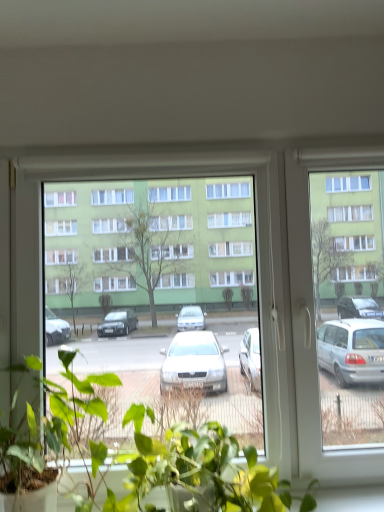
Question: Is green matte plant at center, acting as the second houseplant starting from the right, next to green leafy plant at lower center, which is the first houseplant in right-to-left order?

Choices:
 (A) yes
 (B) no

Answer: (A)

Question: From the image's perspective, does green matte plant at center, acting as the second houseplant starting from the right, appear higher than green leafy plant at lower center, the second houseplant viewed from the left?

Choices:
 (A) no
 (B) yes

Answer: (B)

Question: Is green matte plant at center, acting as the second houseplant starting from the right, wider than green leafy plant at lower center, the second houseplant viewed from the left?

Choices:
 (A) no
 (B) yes

Answer: (B)

Question: Is green matte plant at center, acting as the second houseplant starting from the right, positioned with its back to green leafy plant at lower center, which is the first houseplant in right-to-left order?

Choices:
 (A) yes
 (B) no

Answer: (B)

Question: Is green leafy plant at lower center, which is the first houseplant in right-to-left order, completely or partially inside green matte plant at center, acting as the second houseplant starting from the right?

Choices:
 (A) yes
 (B) no

Answer: (B)

Question: Is green matte plant at center, which appears as the first houseplant when viewed from the left, positioned in front of green leafy plant at lower center, which is the first houseplant in right-to-left order?

Choices:
 (A) no
 (B) yes

Answer: (B)

Question: Is transparent glass window at center not near green matte plant at center, acting as the second houseplant starting from the right?

Choices:
 (A) yes
 (B) no

Answer: (B)

Question: Is transparent glass window at center closer to camera compared to green matte plant at center, acting as the second houseplant starting from the right?

Choices:
 (A) no
 (B) yes

Answer: (A)

Question: Is transparent glass window at center positioned with its back to green matte plant at center, acting as the second houseplant starting from the right?

Choices:
 (A) no
 (B) yes

Answer: (B)

Question: Considering the relative sizes of transparent glass window at center and green matte plant at center, acting as the second houseplant starting from the right, in the image provided, is transparent glass window at center bigger than green matte plant at center, acting as the second houseplant starting from the right,?

Choices:
 (A) no
 (B) yes

Answer: (B)

Question: From a real-world perspective, is transparent glass window at center physically below green matte plant at center, which appears as the first houseplant when viewed from the left?

Choices:
 (A) yes
 (B) no

Answer: (B)

Question: Is transparent glass window at center smaller than green matte plant at center, which appears as the first houseplant when viewed from the left?

Choices:
 (A) yes
 (B) no

Answer: (B)

Question: Would you consider green leafy plant at lower center, the second houseplant viewed from the left, to be distant from transparent glass window at center?

Choices:
 (A) yes
 (B) no

Answer: (B)